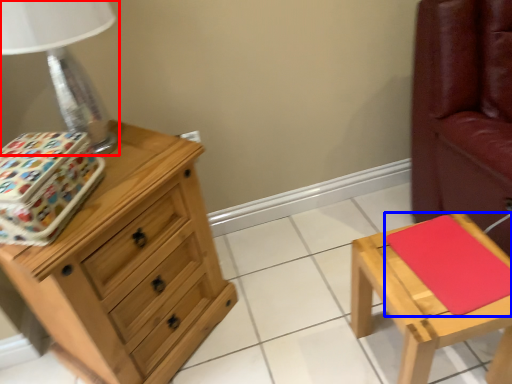
Question: Among these objects, which one is farthest to the camera, table lamp (highlighted by a red box) or pad (highlighted by a blue box)?

Choices:
 (A) table lamp
 (B) pad

Answer: (B)